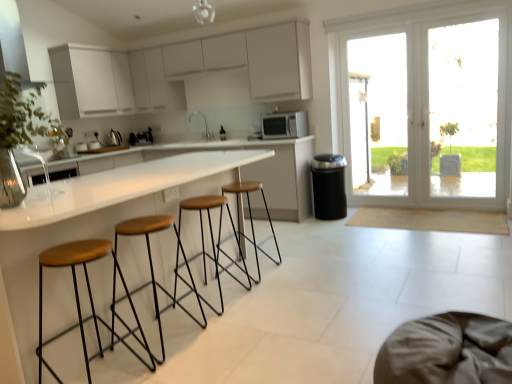
At what (x,y) coordinates should I click in order to perform the action: click on free space that is in between wooden seat stool at center, the second stool from the front, and brown fabric swivel chair at lower right. Please return your answer as a coordinate pair (x, y). This screenshot has height=384, width=512. Looking at the image, I should click on (277, 350).